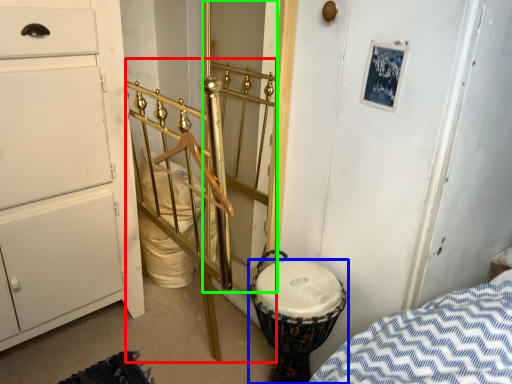
Question: Estimate the real-world distances between objects in this image. Which object is closer to rail (highlighted by a red box), drum (highlighted by a blue box) or door (highlighted by a green box)?

Choices:
 (A) drum
 (B) door

Answer: (A)